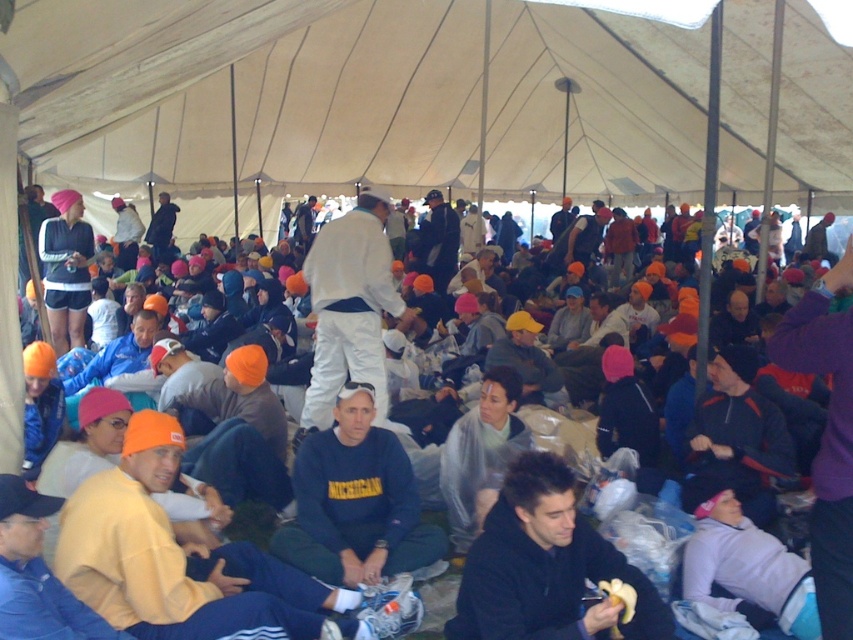
You are organizing a photo shoot and need to ensure that the orange knit cap at center and the dark blue fleece at center fit within a single frame. Given that the camera has a fixed field of view, which object should be moved closer to the camera to ensure both fit without cropping?

The dark blue fleece at center should be moved closer to the camera because the orange knit cap at center is wider, so bringing the narrower dark blue fleece closer would help balance their sizes in the frame.

You are standing at the entrance of the tent and want to take a photo of two specific points inside the tent. The first point is at coordinate point (776, 308) and the second point is at coordinate point (543, 452). Since you want to ensure both points are in focus, which point should you focus on first to make sure both are clear?

To ensure both points are in focus, you should focus on point (543, 452) first because it is closer to you than point (776, 308), which is further away. By focusing on the closer point, the further point will also be within the depth of field.

You are organizing a clothing donation drive and need to stack the black fleece jacket at center and the dark blue fleece at center vertically. Given their widths, which one should you place on the bottom to ensure stability?

The dark blue fleece at center has a greater width than the black fleece jacket at center, so placing the dark blue fleece at center on the bottom will provide a more stable base for the stack.